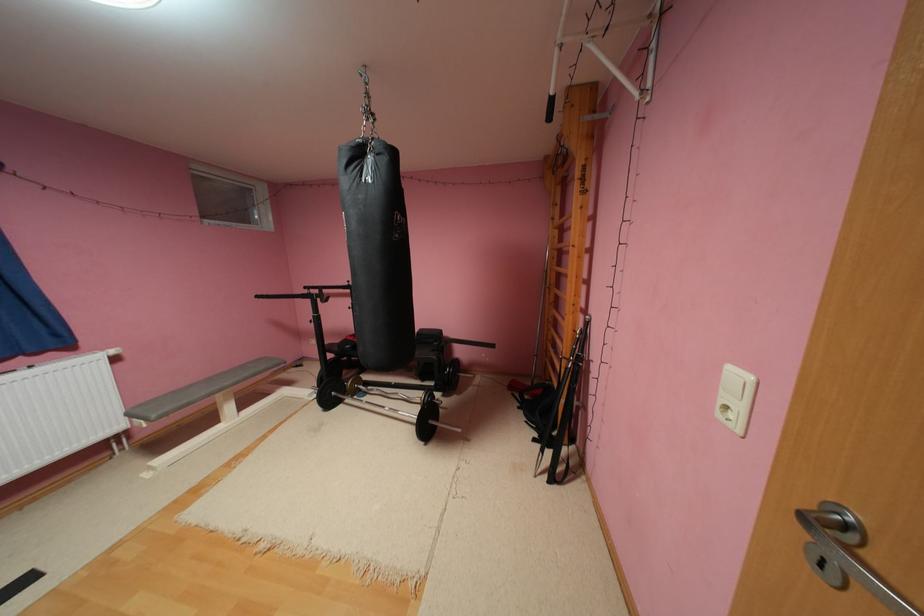
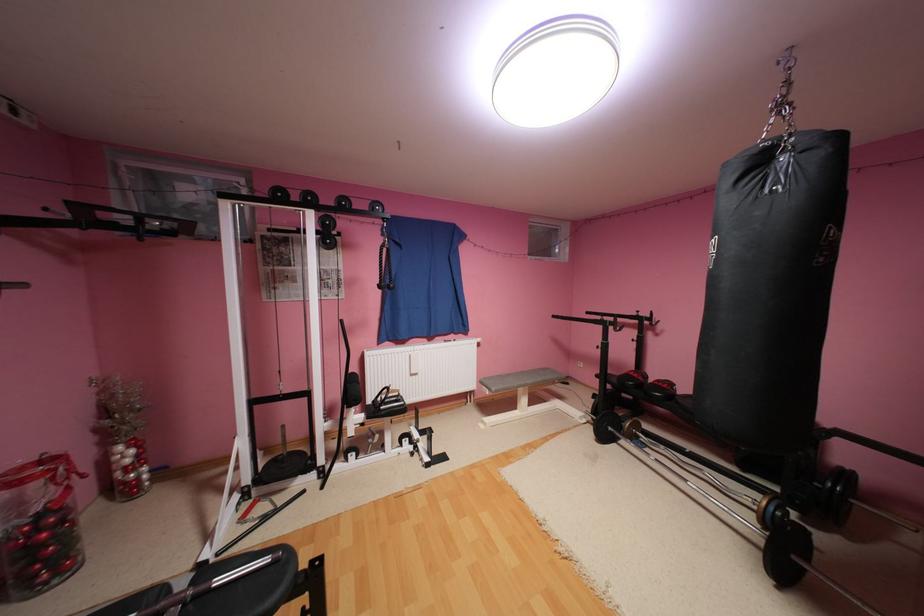
Question: The images are taken continuously from a first-person perspective. In which direction is your viewpoint rotating?

Choices:
 (A) Left
 (B) Right
 (C) Up
 (D) Down

Answer: (A)